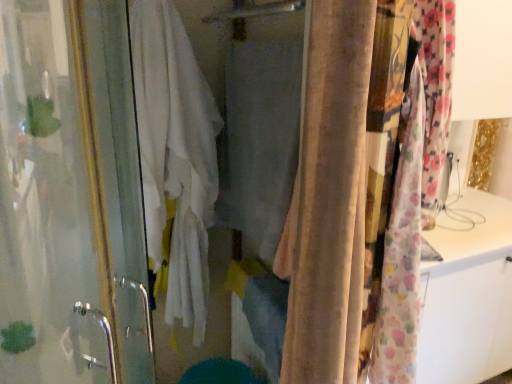
Question: From the image's perspective, is fluffy floral fabric at right, acting as the first curtain starting from the right, positioned above or below beige velvet curtain at center, the 2th curtain from the right?

Choices:
 (A) below
 (B) above

Answer: (A)

Question: From a real-world perspective, relative to beige velvet curtain at center, the 1th curtain when ordered from left to right, is fluffy floral fabric at right, placed as the 2th curtain when sorted from left to right, vertically above or below?

Choices:
 (A) below
 (B) above

Answer: (A)

Question: Estimate the real-world distances between objects in this image. Which object is farther from the transparent glass screen door at left?

Choices:
 (A) fluffy floral fabric at right, placed as the 2th curtain when sorted from left to right
 (B) beige velvet curtain at center, the 1th curtain when ordered from left to right
 (C) white cotton bath towel at center

Answer: (A)

Question: Estimate the real-world distances between objects in this image. Which object is closer to the beige velvet curtain at center, the 2th curtain from the right?

Choices:
 (A) white cotton bath towel at center
 (B) fluffy floral fabric at right, acting as the first curtain starting from the right
 (C) transparent glass screen door at left

Answer: (B)